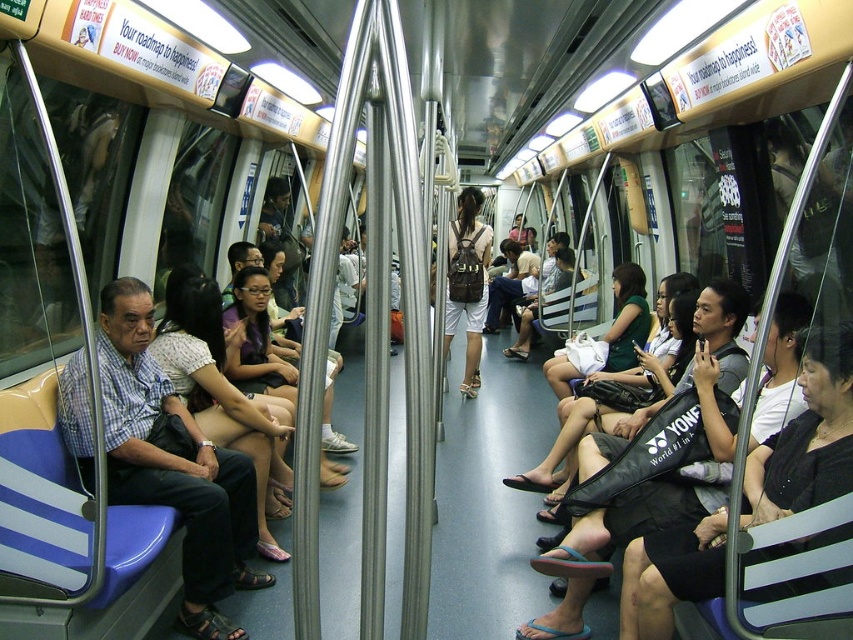
Question: Which object is positioned closest to the black fabric bag at center?

Choices:
 (A) matte white blouse at center
 (B) blue fabric seat at left

Answer: (B)

Question: Does blue fabric seat at left have a larger size compared to black fabric bag at center?

Choices:
 (A) no
 (B) yes

Answer: (A)

Question: Which of the following is the closest to the observer?

Choices:
 (A) matte white blouse at center
 (B) black fabric bag at center
 (C) blue fabric seat at left

Answer: (B)

Question: Is blue fabric seat at left above matte white blouse at center?

Choices:
 (A) no
 (B) yes

Answer: (A)

Question: Which of the following is the closest to the observer?

Choices:
 (A) matte white blouse at center
 (B) black fabric bag at center

Answer: (B)

Question: Is blue fabric seat at left below matte white blouse at center?

Choices:
 (A) no
 (B) yes

Answer: (B)